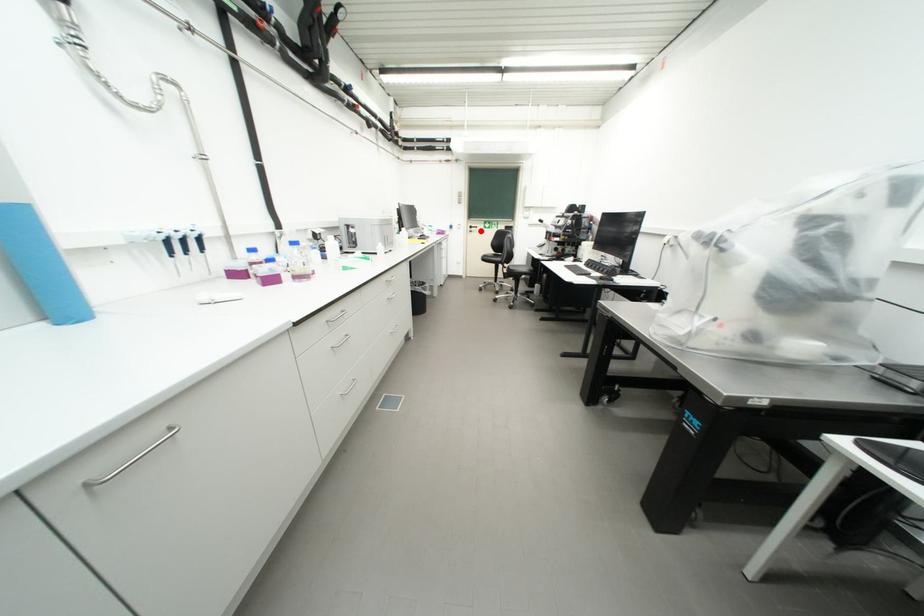
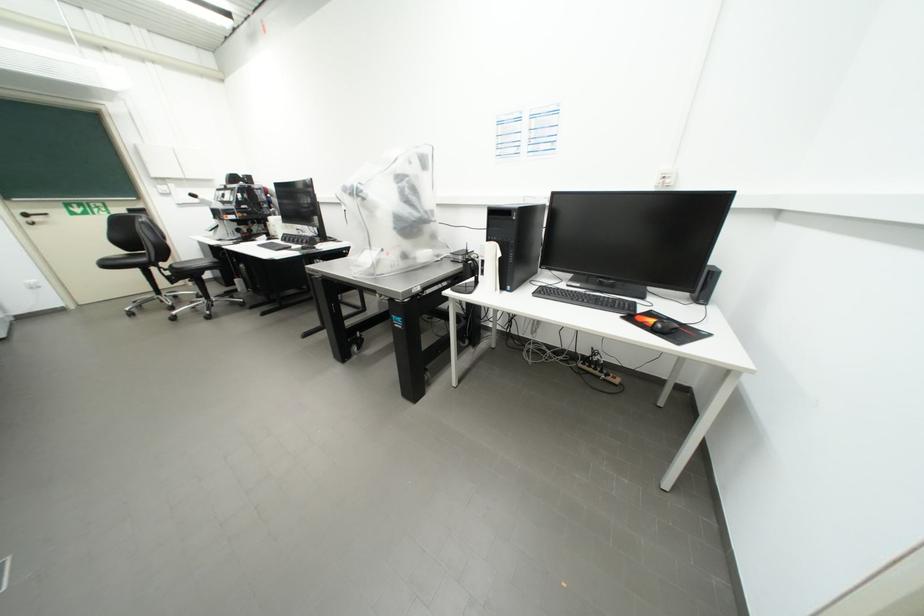
Find the pixel in the second image that matches the highlighted location in the first image.

(43, 220)